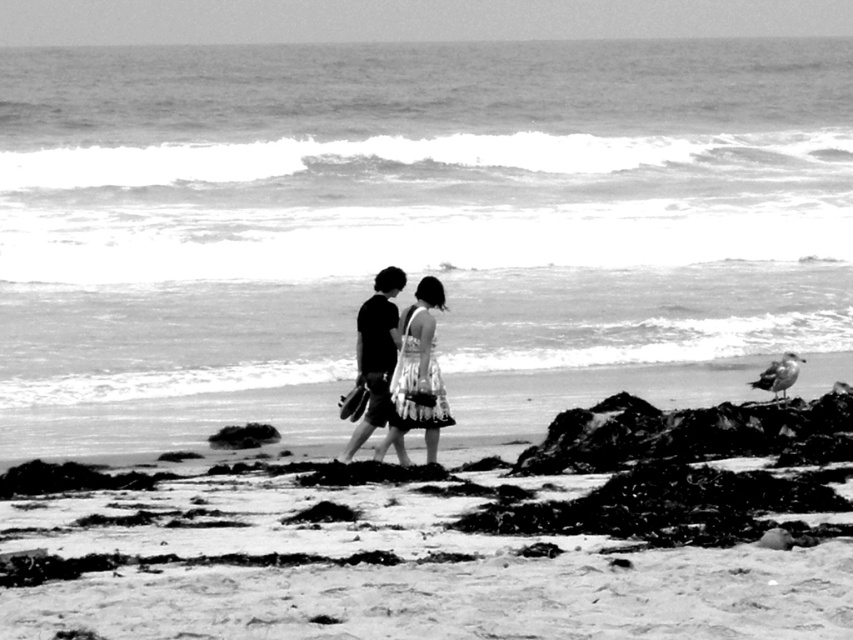
Question: Among these points, which one is nearest to the camera?

Choices:
 (A) (440, 408)
 (B) (254, 477)

Answer: (B)

Question: Can you confirm if smooth sand at center is wider than dark gray fabric shorts at center?

Choices:
 (A) no
 (B) yes

Answer: (B)

Question: Does smooth ocean water at center appear on the right side of dark gray fabric shorts at center?

Choices:
 (A) no
 (B) yes

Answer: (A)

Question: Which point is closer to the camera?

Choices:
 (A) (404, 317)
 (B) (579, 488)

Answer: (B)

Question: Which object is closer to the camera taking this photo?

Choices:
 (A) smooth sand at center
 (B) smooth ocean water at center

Answer: (A)

Question: Does smooth ocean water at center have a lesser width compared to dark gray fabric shorts at center?

Choices:
 (A) no
 (B) yes

Answer: (A)